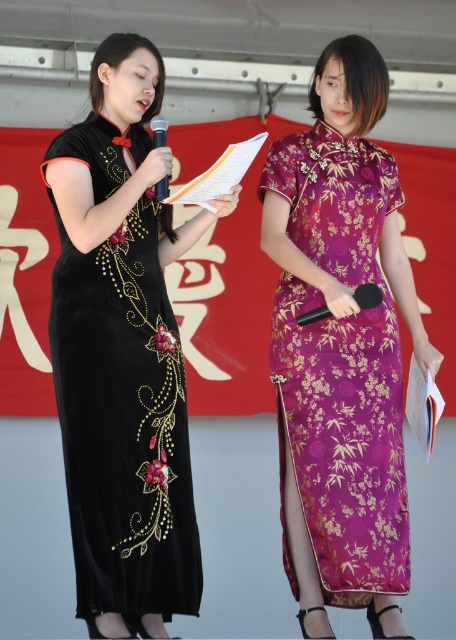
You are a photographer positioned at the camera. You need to adjust your focus to capture the velvet black dress at left clearly. Is it within the standard 4.5 meters focusing range of your camera?

The velvet black dress at left is 3.70 meters from camera, which is within the standard 4.5 meters focusing range. The camera can focus on it clearly.

You are a stagehand preparing to adjust the microphone stand. The purple silk dress at right is currently being worn by a performer who is 5 feet tall. The matte black microphone at center is on a stand that can be raised or lowered. If the performer wants to reach the microphone easily, should you raise or lower the stand?

The purple silk dress at right and matte black microphone at center are 3.72 feet apart. Since the performer is 5 feet tall, lowering the stand would bring the microphone closer to their height, making it easier to reach. Therefore, you should lower the stand.

You are an audience member sitting in the front row of the stage. You notice two points marked in the image. Which point is closer to you, point (104, 492) or point (155, 131)?

Point (104, 492) is closer to the viewer than point (155, 131).